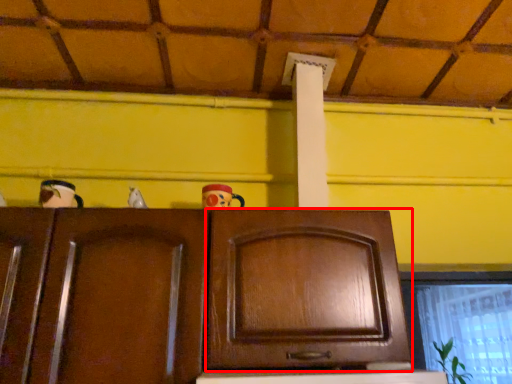
Question: Where is cabinetry (annotated by the red box) located in relation to window in the image?

Choices:
 (A) left
 (B) right

Answer: (A)